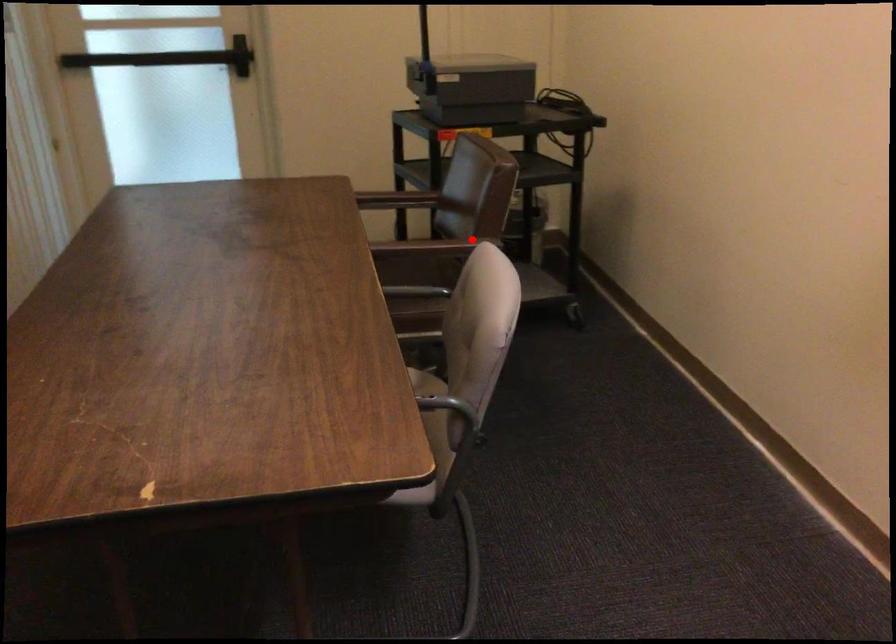
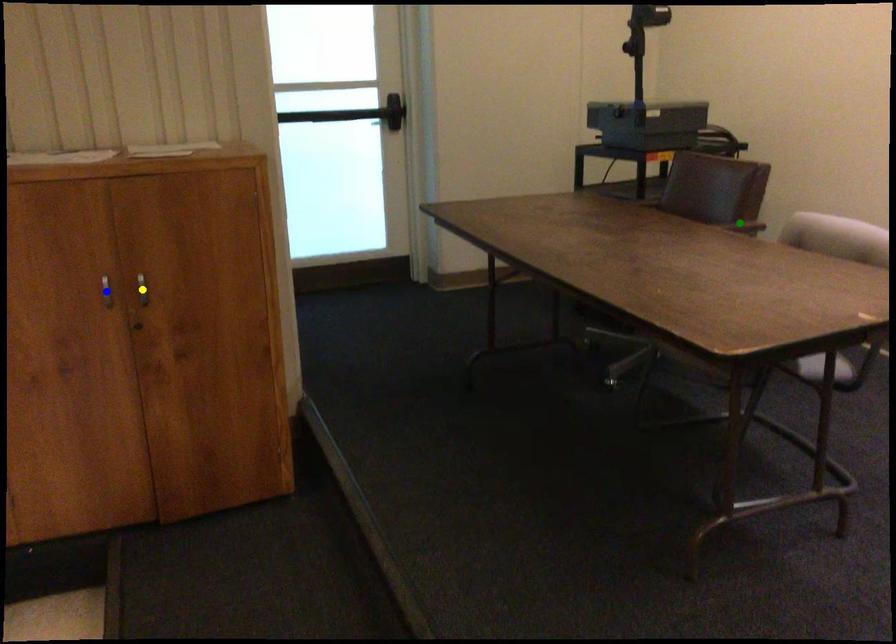
Question: I am providing you with two images of the same scene from different viewpoints. A red point is marked on the first image. You are given multiple points on the second image. Which point in image 2 is actually the same real-world point as the red point in image 1?

Choices:
 (A) green point
 (B) yellow point
 (C) blue point

Answer: (A)